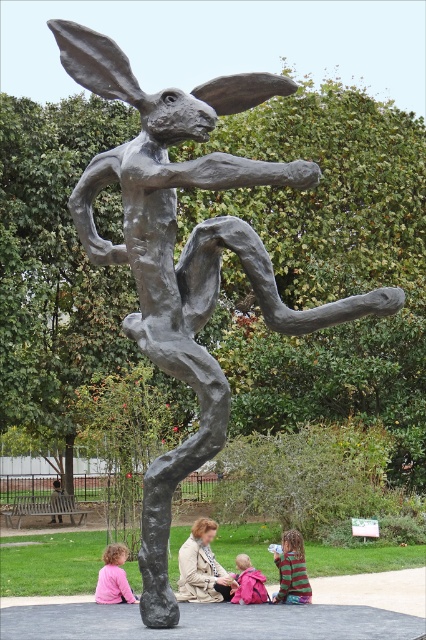
Question: Which point is closer to the camera?

Choices:
 (A) (112, 563)
 (B) (242, 568)
 (C) (210, 572)

Answer: (C)

Question: Which is nearer to the pink fabric at lower left?

Choices:
 (A) pink fabric backpack at lower center
 (B) striped sweater at lower center

Answer: (A)

Question: Is light brown leather jacket at center positioned in front of pink fabric backpack at lower center?

Choices:
 (A) yes
 (B) no

Answer: (A)

Question: Is light brown leather jacket at center to the right of pink fabric at lower left from the viewer's perspective?

Choices:
 (A) no
 (B) yes

Answer: (B)

Question: Which object is closer to the camera taking this photo?

Choices:
 (A) light brown leather jacket at center
 (B) pink fabric backpack at lower center
 (C) pink fabric at lower left

Answer: (C)

Question: Is light brown leather jacket at center closer to the viewer compared to striped sweater at lower center?

Choices:
 (A) yes
 (B) no

Answer: (B)